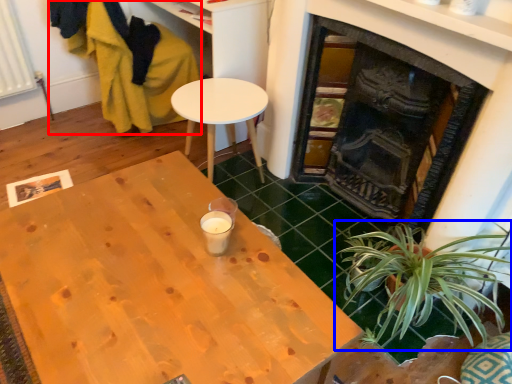
Question: Among these objects, which one is nearest to the camera, swivel chair (highlighted by a red box) or houseplant (highlighted by a blue box)?

Choices:
 (A) swivel chair
 (B) houseplant

Answer: (B)